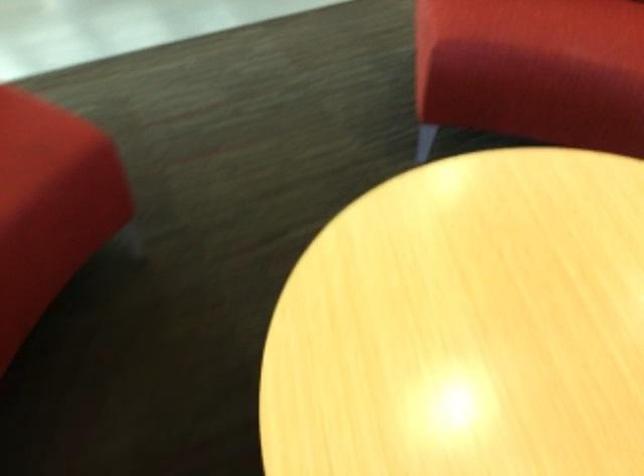
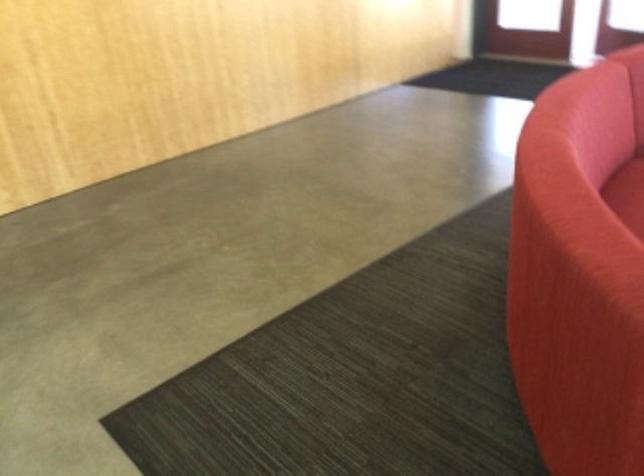
In the scene shown: The images are taken continuously from a first-person perspective. In which direction is your viewpoint rotating?

The camera's rotation is toward right-down.